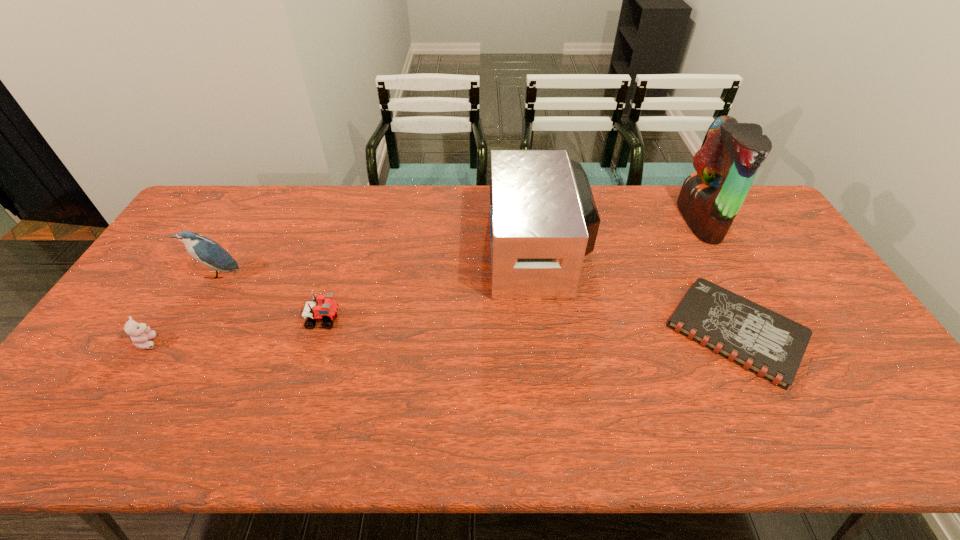
In order to click on teddy bear positioned at the left edge in this screenshot , I will do tap(140, 334).

What are the coordinates of `object located in the right edge section of the desktop` in the screenshot? It's located at (772, 346).

This screenshot has height=540, width=960. In the image, there is a desktop. In order to click on free region at the far edge in this screenshot , I will do `click(426, 198)`.

Where is `vacant space at the near edge`? The width and height of the screenshot is (960, 540). vacant space at the near edge is located at coordinates (360, 420).

I want to click on vacant region at the left edge of the desktop, so click(x=84, y=390).

Image resolution: width=960 pixels, height=540 pixels. What are the coordinates of `free region at the right edge of the desktop` in the screenshot? It's located at (812, 300).

In the image, there is a desktop. Where is `free space at the near left corner`? This screenshot has width=960, height=540. free space at the near left corner is located at coordinates [85, 417].

You are a GUI agent. You are given a task and a screenshot of the screen. Output one action in this format:
    pyautogui.click(x=<x>, y=<y>)
    Task: Click on the free space at the near right corner of the desktop
    This screenshot has height=540, width=960.
    Given the screenshot: What is the action you would take?
    pyautogui.click(x=913, y=437)

This screenshot has width=960, height=540. I want to click on vacant space in between the Lego and the teddy bear, so click(x=237, y=330).

Find the location of a particular element. The width and height of the screenshot is (960, 540). vacant area that lies between the fifth shortest object and the third object from left to right is located at coordinates (432, 285).